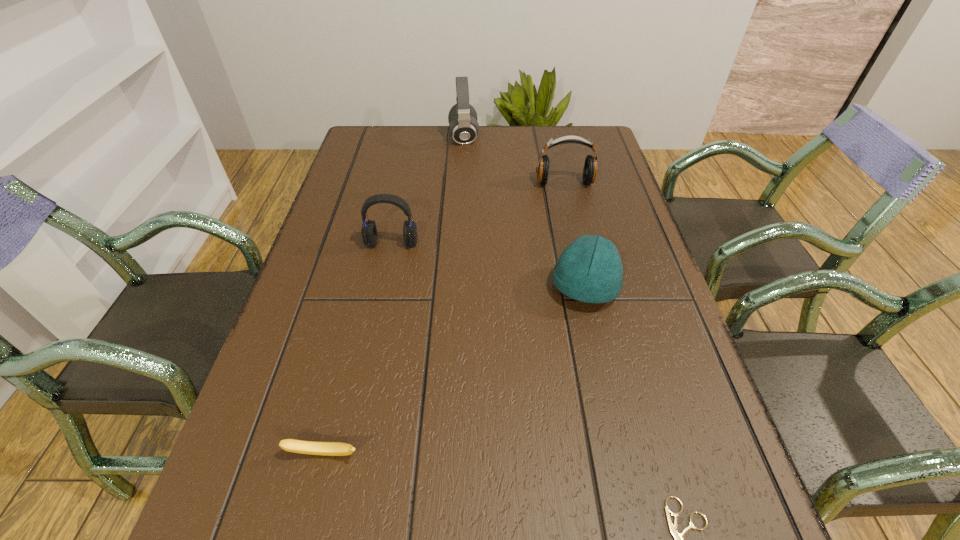
In the image, there is a desktop. Identify the location of vacant space at the far edge. (539, 147).

This screenshot has width=960, height=540. I want to click on vacant position at the left edge of the desktop, so click(339, 311).

Identify the location of vacant region at the right edge of the desktop. Image resolution: width=960 pixels, height=540 pixels. (685, 476).

You are a GUI agent. You are given a task and a screenshot of the screen. Output one action in this format:
    pyautogui.click(x=<x>, y=<y>)
    Task: Click on the free space between the second headset from left to right and the third nearest object
    Image resolution: width=960 pixels, height=540 pixels.
    Given the screenshot: What is the action you would take?
    pyautogui.click(x=524, y=212)

In order to click on blank region between the leftmost headset and the second shortest object in this screenshot , I will do `click(358, 348)`.

Locate an element on the screen. This screenshot has height=540, width=960. empty location between the fourth nearest object and the second farthest object is located at coordinates (478, 213).

You are a GUI agent. You are given a task and a screenshot of the screen. Output one action in this format:
    pyautogui.click(x=<x>, y=<y>)
    Task: Click on the empty space between the farthest object and the beanie
    The width and height of the screenshot is (960, 540).
    Given the screenshot: What is the action you would take?
    pyautogui.click(x=524, y=212)

The width and height of the screenshot is (960, 540). Identify the location of free space between the second shortest object and the farthest headset. (394, 296).

Identify the location of vacant area that lies between the fifth farthest object and the third nearest object. (454, 370).

Locate an element on the screen. free space between the beanie and the rightmost headset is located at coordinates (574, 235).